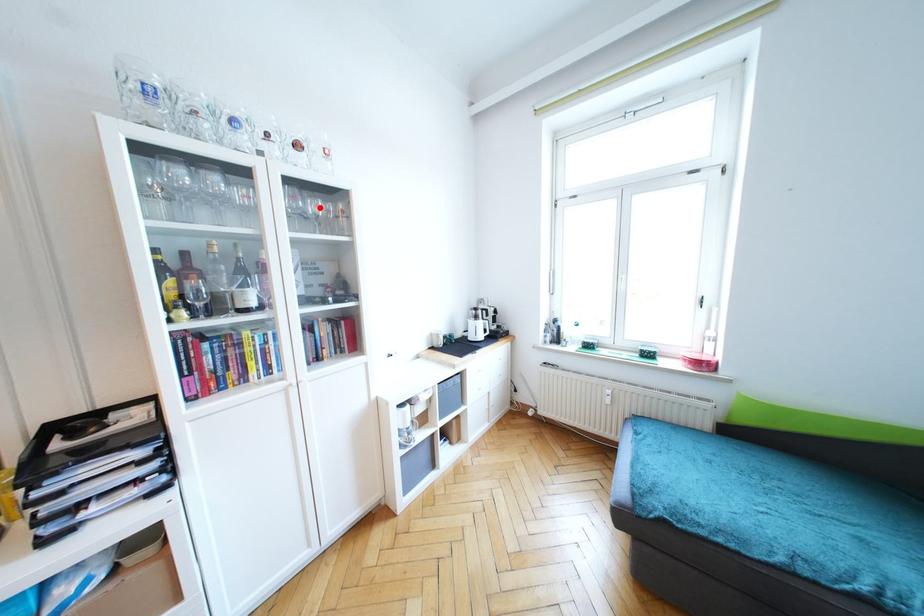
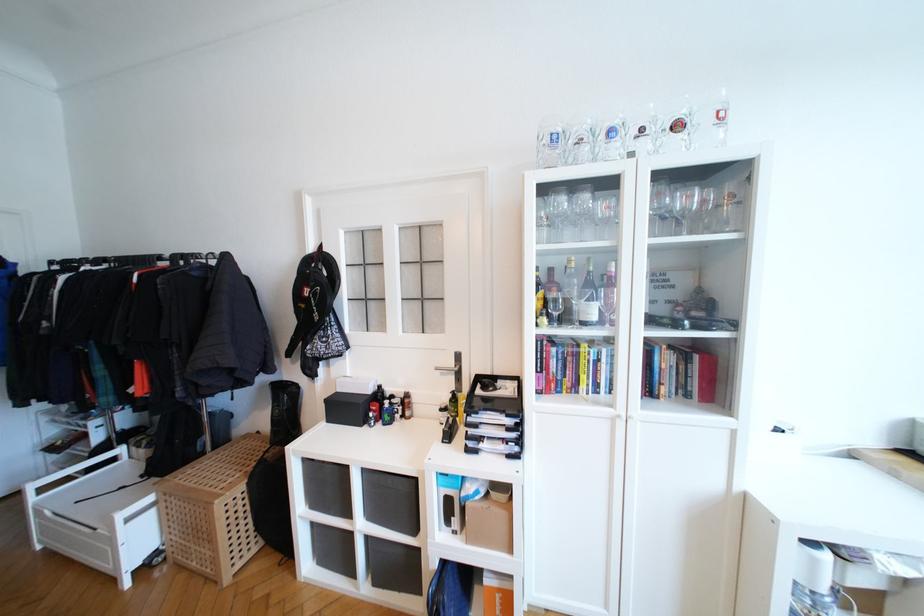
Locate, in the second image, the point that corresponds to the highlighted location in the first image.

(691, 200)